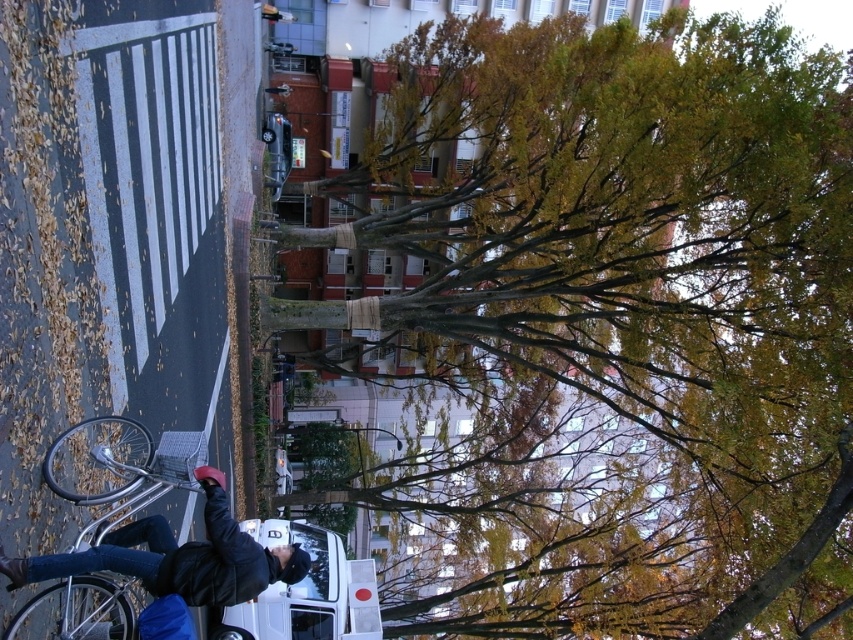
You are a pedestrian trying to cross the street at the zebra crossing. You see the dark blue jeans at lower left and the white matte van at center. Which object is closer to you as you stand at the zebra crossing?

The dark blue jeans at lower left is positioned over the white matte van at center, meaning it is closer to you.